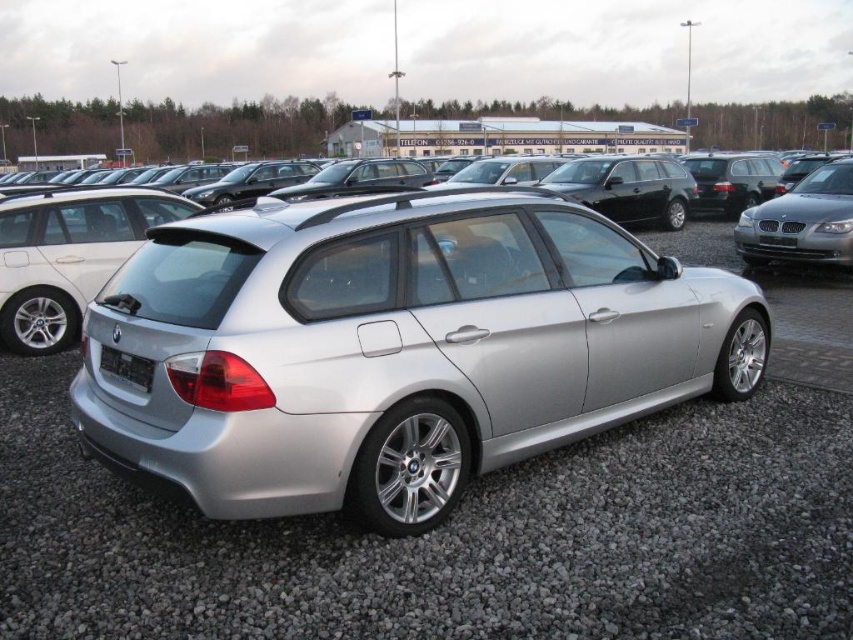
In the scene shown: Between silver metallic sedan at center and satin silver sedan at center, which one appears on the right side from the viewer's perspective?

silver metallic sedan at center

Describe the element at coordinates (396, 348) in the screenshot. I see `silver metallic sedan at center` at that location.

Identify the location of silver metallic sedan at center. The image size is (853, 640). (396, 348).

Is silver gravel at center shorter than satin black sedan at center?

Yes, silver gravel at center is shorter than satin black sedan at center.

Looking at this image, is silver gravel at center to the left of satin black sedan at center from the viewer's perspective?

Indeed, silver gravel at center is positioned on the left side of satin black sedan at center.

The width and height of the screenshot is (853, 640). I want to click on silver gravel at center, so click(453, 538).

Who is shorter, silver gravel at center or black plastic license plate at rear?

Standing shorter between the two is silver gravel at center.

How far apart are silver gravel at center and black plastic license plate at rear?

They are 1.00 meters apart.

Is point (381, 580) more distant than point (120, 365)?

No, it is in front of (120, 365).

Where is `silver gravel at center`? The width and height of the screenshot is (853, 640). silver gravel at center is located at coordinates (453, 538).